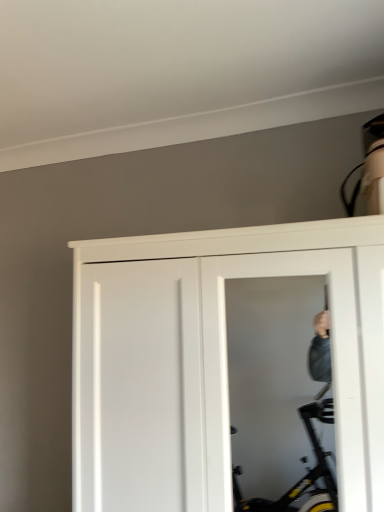
Question: Is transparent plastic screen door at center in front of or behind white matte door at center in the image?

Choices:
 (A) behind
 (B) front

Answer: (A)

Question: Is transparent plastic screen door at center inside the boundaries of white matte door at center, or outside?

Choices:
 (A) outside
 (B) inside

Answer: (B)

Question: In the image, is transparent plastic screen door at center on the left side or the right side of white matte door at center?

Choices:
 (A) left
 (B) right

Answer: (B)

Question: Considering the positions of point pos(269,230) and point pos(223,428), is point pos(269,230) closer or farther from the camera than point pos(223,428)?

Choices:
 (A) farther
 (B) closer

Answer: (B)

Question: Would you say white matte door at center is to the left or to the right of transparent plastic screen door at center in the picture?

Choices:
 (A) left
 (B) right

Answer: (A)

Question: Is white matte door at center wider or thinner than transparent plastic screen door at center?

Choices:
 (A) wide
 (B) thin

Answer: (A)

Question: Looking at the image, does white matte door at center seem bigger or smaller compared to transparent plastic screen door at center?

Choices:
 (A) small
 (B) big

Answer: (B)